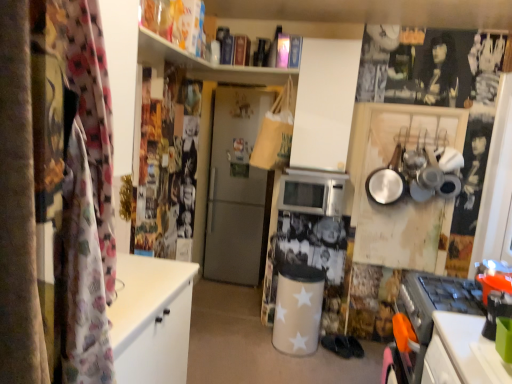
Question: Is silver metallic microwave at center at the left side of black fabric shoe at center?

Choices:
 (A) yes
 (B) no

Answer: (A)

Question: Considering the relative sizes of silver metallic microwave at center and black fabric shoe at center in the image provided, is silver metallic microwave at center taller than black fabric shoe at center?

Choices:
 (A) yes
 (B) no

Answer: (A)

Question: Is silver metallic microwave at center turned away from black fabric shoe at center?

Choices:
 (A) no
 (B) yes

Answer: (A)

Question: Is black fabric shoe at center completely or partially inside silver metallic microwave at center?

Choices:
 (A) yes
 (B) no

Answer: (B)

Question: From the image's perspective, would you say silver metallic microwave at center is positioned over black fabric shoe at center?

Choices:
 (A) yes
 (B) no

Answer: (A)

Question: Can you confirm if silver metallic microwave at center is thinner than black fabric shoe at center?

Choices:
 (A) no
 (B) yes

Answer: (A)

Question: From a real-world perspective, does satin silver refrigerator at center stand above black fabric shoe at center?

Choices:
 (A) no
 (B) yes

Answer: (B)

Question: Is satin silver refrigerator at center next to black fabric shoe at center?

Choices:
 (A) no
 (B) yes

Answer: (A)

Question: Is satin silver refrigerator at center not within black fabric shoe at center?

Choices:
 (A) yes
 (B) no

Answer: (A)

Question: Does satin silver refrigerator at center have a greater width compared to black fabric shoe at center?

Choices:
 (A) no
 (B) yes

Answer: (B)

Question: Does satin silver refrigerator at center come behind black fabric shoe at center?

Choices:
 (A) yes
 (B) no

Answer: (A)

Question: From a real-world perspective, is satin silver refrigerator at center beneath black fabric shoe at center?

Choices:
 (A) yes
 (B) no

Answer: (B)

Question: Can you confirm if satin silver refrigerator at center is bigger than silver metallic microwave at center?

Choices:
 (A) no
 (B) yes

Answer: (B)